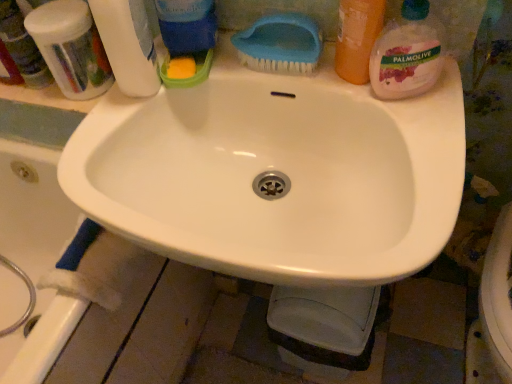
Question: Is translucent plastic toothbrushes at upper left oriented away from palmolive liquid soap at upper right, the fourth cleaning product viewed from the left?

Choices:
 (A) yes
 (B) no

Answer: (B)

Question: Does translucent plastic toothbrushes at upper left turn towards palmolive liquid soap at upper right, which appears as the first cleaning product when viewed from the right?

Choices:
 (A) yes
 (B) no

Answer: (B)

Question: From the image's perspective, is translucent plastic toothbrushes at upper left located above palmolive liquid soap at upper right, which appears as the first cleaning product when viewed from the right?

Choices:
 (A) yes
 (B) no

Answer: (A)

Question: From a real-world perspective, is translucent plastic toothbrushes at upper left physically below palmolive liquid soap at upper right, which appears as the first cleaning product when viewed from the right?

Choices:
 (A) no
 (B) yes

Answer: (B)

Question: Does translucent plastic toothbrushes at upper left appear on the left side of palmolive liquid soap at upper right, the fourth cleaning product viewed from the left?

Choices:
 (A) yes
 (B) no

Answer: (A)

Question: Considering the relative sizes of translucent plastic toothbrushes at upper left and palmolive liquid soap at upper right, which appears as the first cleaning product when viewed from the right, in the image provided, is translucent plastic toothbrushes at upper left taller than palmolive liquid soap at upper right, which appears as the first cleaning product when viewed from the right,?

Choices:
 (A) no
 (B) yes

Answer: (A)

Question: Is blue plastic brush at upper center at the back of white glossy sink at center?

Choices:
 (A) yes
 (B) no

Answer: (B)

Question: Is white glossy sink at center to the left of blue plastic brush at upper center from the viewer's perspective?

Choices:
 (A) no
 (B) yes

Answer: (B)

Question: Is the surface of white glossy sink at center in direct contact with blue plastic brush at upper center?

Choices:
 (A) yes
 (B) no

Answer: (B)

Question: Is white glossy sink at center facing towards blue plastic brush at upper center?

Choices:
 (A) no
 (B) yes

Answer: (A)

Question: Is blue plastic brush at upper center located within white glossy sink at center?

Choices:
 (A) no
 (B) yes

Answer: (A)

Question: Considering the relative sizes of white glossy sink at center and blue plastic brush at upper center in the image provided, is white glossy sink at center smaller than blue plastic brush at upper center?

Choices:
 (A) yes
 (B) no

Answer: (B)

Question: From the image's perspective, is translucent plastic toothbrushes at upper left located above white glossy sink at center?

Choices:
 (A) yes
 (B) no

Answer: (A)